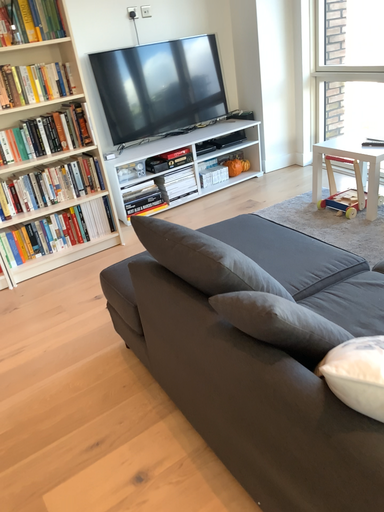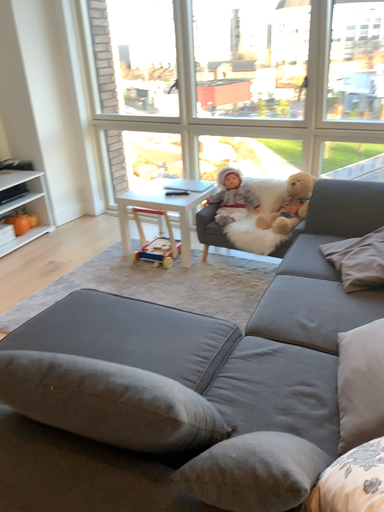
Question: Which way did the camera rotate in the video?

Choices:
 (A) rotated downward
 (B) rotated upward

Answer: (B)